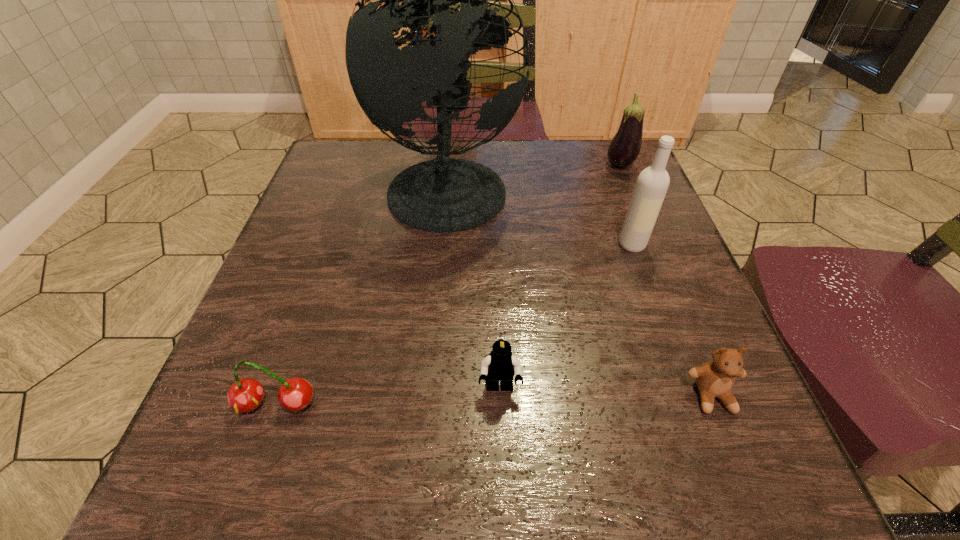
The width and height of the screenshot is (960, 540). I want to click on object at the far right corner, so click(625, 146).

The width and height of the screenshot is (960, 540). In order to click on vacant area at the near edge of the desktop in this screenshot , I will do `click(425, 485)`.

In the image, there is a desktop. What are the coordinates of `vacant space at the left edge` in the screenshot? It's located at (302, 429).

Locate an element on the screen. vacant region at the right edge is located at coordinates (605, 246).

Locate an element on the screen. free space at the far left corner is located at coordinates (337, 176).

Where is `free spot between the Lego and the eggplant`? free spot between the Lego and the eggplant is located at coordinates (560, 277).

Find the location of a particular element. free space between the cherry and the third tallest object is located at coordinates (447, 285).

Locate an element on the screen. Image resolution: width=960 pixels, height=540 pixels. empty space between the globe and the vodka is located at coordinates (540, 215).

You are a GUI agent. You are given a task and a screenshot of the screen. Output one action in this format:
    pyautogui.click(x=<x>, y=<y>)
    Task: Click on the free spot between the teddy bear and the vodka
    
    Given the screenshot: What is the action you would take?
    pyautogui.click(x=672, y=320)

Identify the location of free space between the Lego and the fifth shortest object. This screenshot has height=540, width=960. (566, 316).